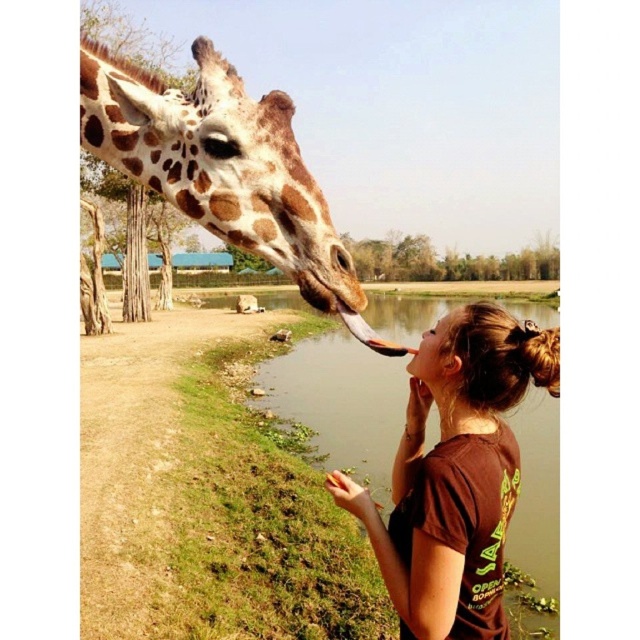
Question: Can you confirm if brown matte shirt at center is positioned above spotted fur giraffe at upper left?

Choices:
 (A) no
 (B) yes

Answer: (A)

Question: Which object appears farthest from the camera in this image?

Choices:
 (A) brown matte shirt at center
 (B) spotted fur giraffe at upper left

Answer: (A)

Question: Is brown matte shirt at center in front of spotted fur giraffe at upper left?

Choices:
 (A) yes
 (B) no

Answer: (B)

Question: Which of the following is the farthest from the observer?

Choices:
 (A) 99,97
 (B) 422,531

Answer: (A)

Question: Does brown matte shirt at center appear over spotted fur giraffe at upper left?

Choices:
 (A) no
 (B) yes

Answer: (A)

Question: Which of the following is the closest to the observer?

Choices:
 (A) 346,508
 (B) 195,42

Answer: (A)